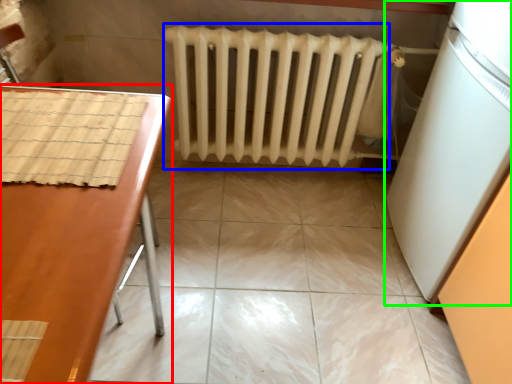
Question: Based on their relative distances, which object is farther from furniture (highlighted by a red box)? Choose from radiator (highlighted by a blue box) and appliance (highlighted by a green box).

Choices:
 (A) radiator
 (B) appliance

Answer: (B)